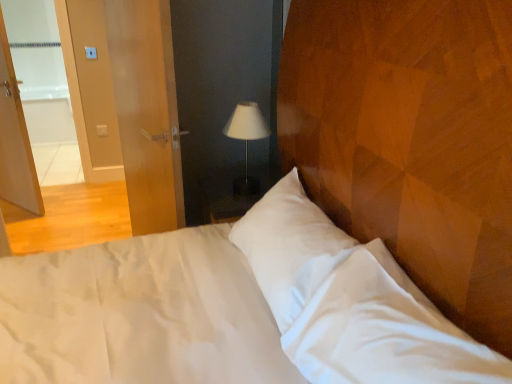
The image size is (512, 384). What are the coordinates of `white fabric lampshade at center` in the screenshot? It's located at (246, 141).

Is point (256, 194) positioned before point (96, 130)?

Yes, point (256, 194) is closer to viewer.

Is white fabric lampshade at center wider than white plastic light switch at upper left?

Indeed, white fabric lampshade at center has a greater width compared to white plastic light switch at upper left.

Is white fabric lampshade at center far away from white plastic light switch at upper left?

white fabric lampshade at center is positioned a significant distance from white plastic light switch at upper left.

Which is in front, point (134, 94) or point (104, 127)?

The point (134, 94) is closer to the camera.

Would you consider matte wood door at left to be distant from white plastic light switch at upper left?

Indeed, matte wood door at left is not near white plastic light switch at upper left.

Considering the sizes of matte wood door at left and white plastic light switch at upper left in the image, is matte wood door at left taller or shorter than white plastic light switch at upper left?

In the image, matte wood door at left appears to be taller than white plastic light switch at upper left.

Is matte wood door at left not inside white plastic light switch at upper left?

Yes.

Is white plastic light switch at upper left thinner than white fabric lampshade at center?

Correct, the width of white plastic light switch at upper left is less than that of white fabric lampshade at center.

Would you say white fabric lampshade at center is part of white plastic light switch at upper left's contents?

No.

From a real-world perspective, relative to white fabric lampshade at center, is white plastic light switch at upper left vertically above or below?

white plastic light switch at upper left is below white fabric lampshade at center.

The image size is (512, 384). Identify the location of lamp that appears in front of the white plastic light switch at upper left. (246, 141).

Which object is closer to the camera, white fabric lampshade at center or matte wood door at left?

Positioned in front is matte wood door at left.

Does white fabric lampshade at center have a lesser height compared to matte wood door at left?

Correct, white fabric lampshade at center is not as tall as matte wood door at left.

Between white fabric lampshade at center and matte wood door at left, which one has smaller size?

white fabric lampshade at center.

Is white fabric lampshade at center positioned far away from matte wood door at left?

They are positioned close to each other.

The image size is (512, 384). In order to click on screen door on the left of the white fabric lampshade at center in this screenshot , I will do `click(146, 111)`.

How many degrees apart are the facing directions of matte wood door at left and white fabric lampshade at center?

The angular difference between matte wood door at left and white fabric lampshade at center is 8.84 degrees.

Does point (164, 4) lie behind point (236, 185)?

No, it is not.

Considering the sizes of objects matte wood door at left and white fabric lampshade at center in the image provided, who is wider, matte wood door at left or white fabric lampshade at center?

Wider between the two is white fabric lampshade at center.

Would you say white plastic light switch at upper left is outside matte wood door at left?

white plastic light switch at upper left lies outside matte wood door at left's area.

Can you confirm if white plastic light switch at upper left is positioned to the left of matte wood door at left?

Yes, white plastic light switch at upper left is to the left of matte wood door at left.

Is white plastic light switch at upper left shorter than matte wood door at left?

Yes.

Find the location of a particular element. light switch below the white fabric lampshade at center (from a real-world perspective) is located at coordinates (102, 130).

I want to click on light switch on the left side of matte wood door at left, so click(x=102, y=130).

When comparing their distances from white fabric lampshade at center, does white plastic light switch at upper left or matte wood door at left seem closer?

matte wood door at left.

When comparing their distances from white fabric lampshade at center, does matte wood door at left or white plastic light switch at upper left seem further?

white plastic light switch at upper left is positioned further to the anchor white fabric lampshade at center.

Considering their positions, is white fabric lampshade at center positioned further to matte wood door at left than white plastic light switch at upper left?

Among the two, white plastic light switch at upper left is located further to matte wood door at left.

Based on their spatial positions, is matte wood door at left or white fabric lampshade at center closer to white plastic light switch at upper left?

matte wood door at left lies closer to white plastic light switch at upper left than the other object.

Which object lies further to the anchor point white plastic light switch at upper left, white fabric lampshade at center or matte wood door at left?

white fabric lampshade at center is positioned further to the anchor white plastic light switch at upper left.

Estimate the real-world distances between objects in this image. Which object is closer to matte wood door at left, white plastic light switch at upper left or white fabric lampshade at center?

white fabric lampshade at center.

Where is `lamp between matte wood door at left and white plastic light switch at upper left along the z-axis`? The image size is (512, 384). lamp between matte wood door at left and white plastic light switch at upper left along the z-axis is located at coordinates (246, 141).